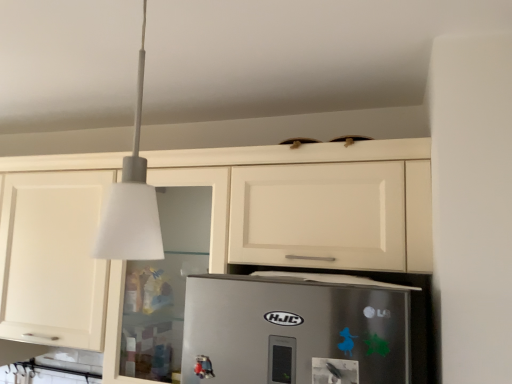
Question: Should I look upward or downward to see white matte cabinet at upper center?

Choices:
 (A) up
 (B) down

Answer: (B)

Question: Can we say white matte lampshade at upper center lies outside white matte cabinet at upper center?

Choices:
 (A) no
 (B) yes

Answer: (B)

Question: Is white matte lampshade at upper center aimed at white matte cabinet at upper center?

Choices:
 (A) yes
 (B) no

Answer: (B)

Question: Is white matte lampshade at upper center shorter than white matte cabinet at upper center?

Choices:
 (A) no
 (B) yes

Answer: (B)

Question: Considering the relative positions of white matte lampshade at upper center and white matte cabinet at upper center in the image provided, is white matte lampshade at upper center behind white matte cabinet at upper center?

Choices:
 (A) yes
 (B) no

Answer: (B)

Question: Can you confirm if white matte lampshade at upper center is wider than white matte cabinet at upper center?

Choices:
 (A) yes
 (B) no

Answer: (B)

Question: Is white matte lampshade at upper center beside white matte cabinet at upper center?

Choices:
 (A) no
 (B) yes

Answer: (A)

Question: Could white matte lampshade at upper center be considered to be inside white matte cabinet at upper center?

Choices:
 (A) no
 (B) yes

Answer: (A)

Question: Is white matte cabinet at upper center wider than white matte lampshade at upper center?

Choices:
 (A) yes
 (B) no

Answer: (A)

Question: Is white matte cabinet at upper center further to the viewer compared to white matte lampshade at upper center?

Choices:
 (A) yes
 (B) no

Answer: (A)

Question: Is the surface of white matte cabinet at upper center in direct contact with white matte lampshade at upper center?

Choices:
 (A) no
 (B) yes

Answer: (A)

Question: From a real-world perspective, is white matte cabinet at upper center below white matte lampshade at upper center?

Choices:
 (A) yes
 (B) no

Answer: (A)

Question: Is white matte cabinet at upper center thinner than white matte lampshade at upper center?

Choices:
 (A) no
 (B) yes

Answer: (A)

Question: Is white matte lampshade at upper center in front of or behind white matte cabinet at upper center in the image?

Choices:
 (A) front
 (B) behind

Answer: (A)